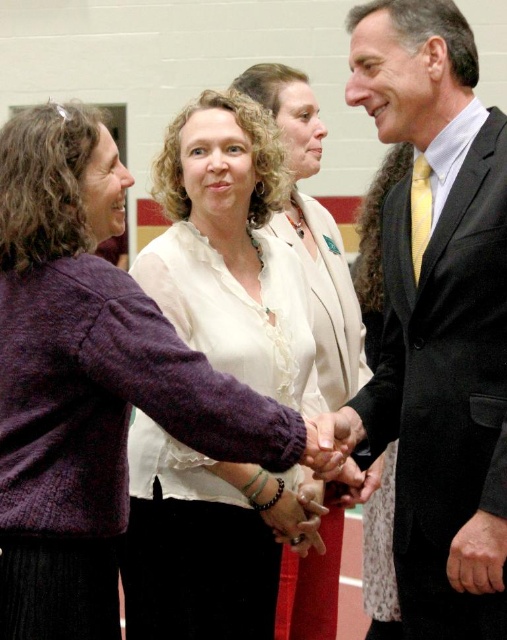
Question: Considering the real-world distances, which object is farthest from the white satin blouse at center?

Choices:
 (A) smooth skin hand at center
 (B) smooth leather hand at center
 (C) matte black bracelet at center
 (D) black suit at right

Answer: (A)

Question: In this image, where is knitted purple sweater at left located relative to white satin blouse at center?

Choices:
 (A) left
 (B) right

Answer: (A)

Question: Which point is farther to the camera?

Choices:
 (A) (485, 240)
 (B) (311, 486)

Answer: (B)

Question: Can you confirm if white satin blouse at center is positioned to the right of matte purple sweater at center?

Choices:
 (A) no
 (B) yes

Answer: (B)

Question: From the image, what is the correct spatial relationship of smooth skin hand at center in relation to matte purple sweater at center?

Choices:
 (A) right
 (B) left

Answer: (A)

Question: Which of the following is the farthest from the observer?

Choices:
 (A) (x=308, y=532)
 (B) (x=337, y=236)

Answer: (B)